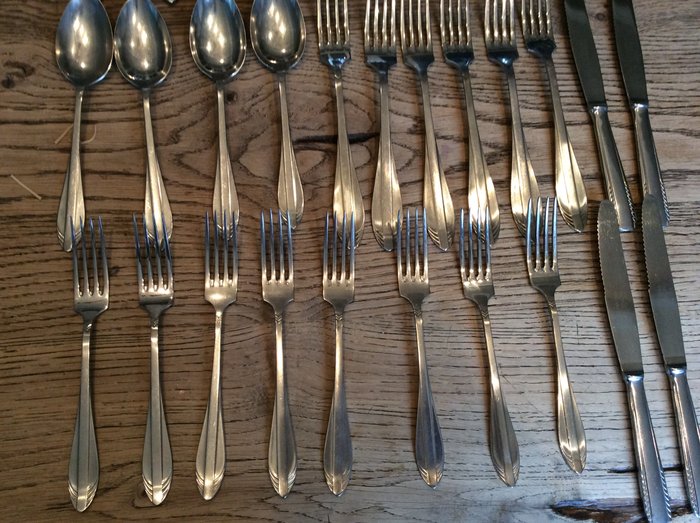
Locate an element on the screen. This screenshot has height=523, width=700. spoons is located at coordinates (74, 51), (132, 48), (204, 39), (280, 31).